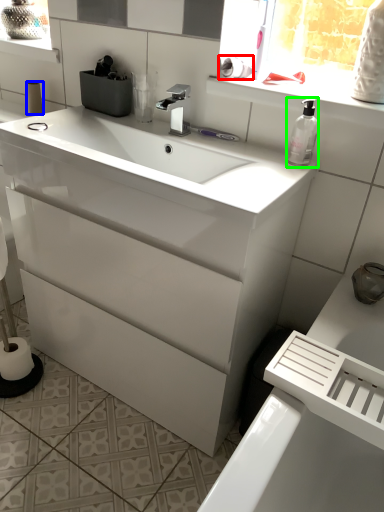
Question: Estimate the real-world distances between objects in this image. Which object is closer to toilet paper (highlighted by a red box), toilet paper (highlighted by a blue box) or soap dispenser (highlighted by a green box)?

Choices:
 (A) toilet paper
 (B) soap dispenser

Answer: (B)